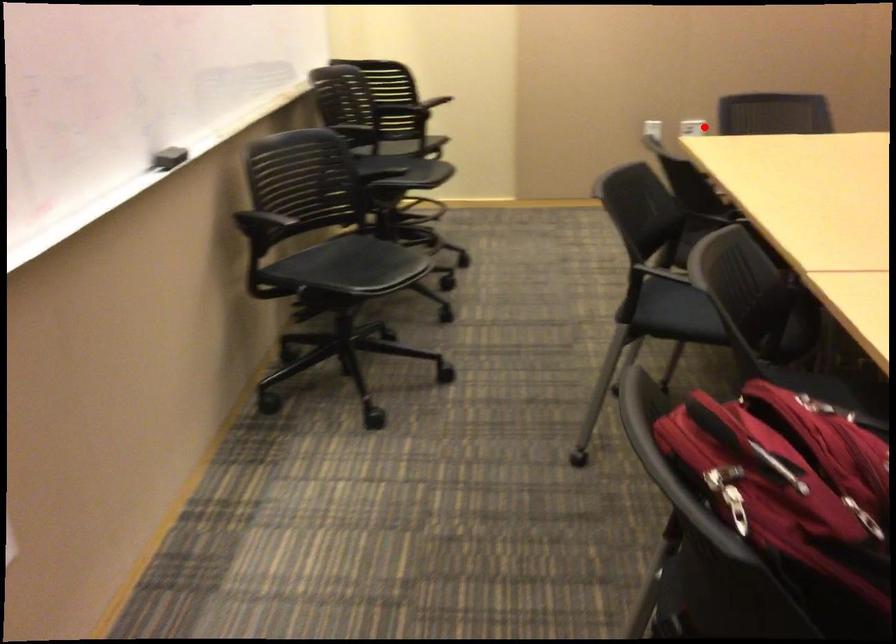
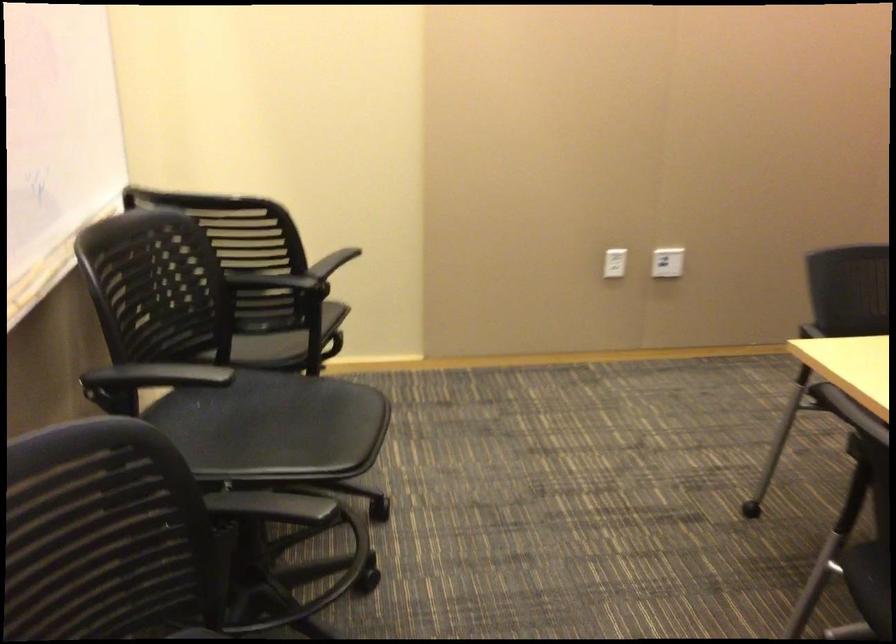
Question: I am providing you with two images of the same scene from different viewpoints. A red point is shown in image1. For the corresponding object point in image2, is it positioned nearer or farther from the camera?

Choices:
 (A) Nearer
 (B) Farther

Answer: (A)